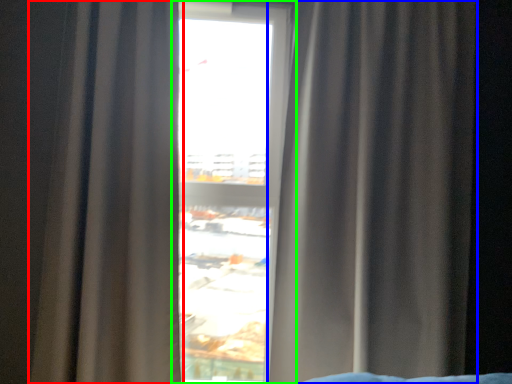
Question: Which object is positioned farthest from curtain (highlighted by a red box)? Select from curtain (highlighted by a blue box) and window (highlighted by a green box).

Choices:
 (A) curtain
 (B) window

Answer: (A)